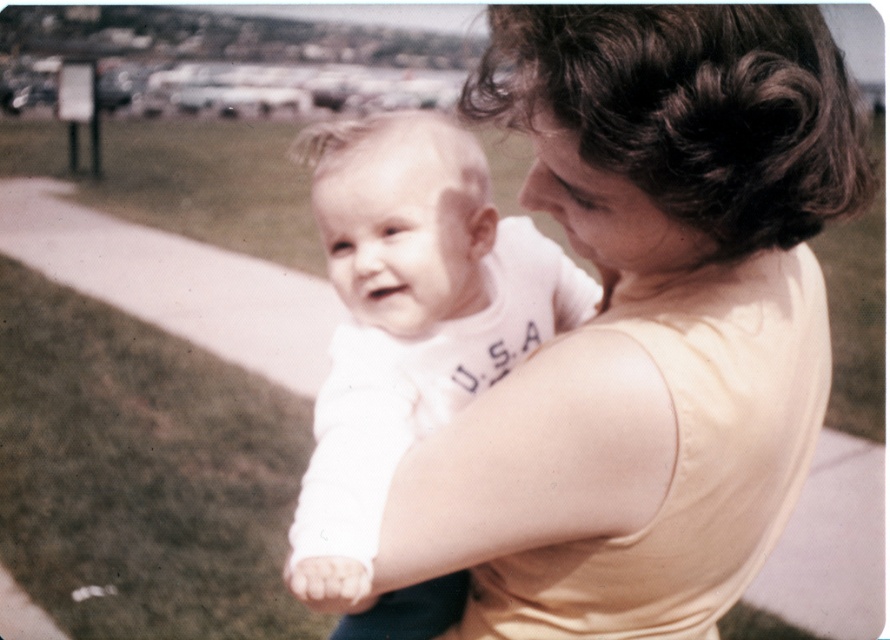
What are the exact coordinates of the matte yellow tank top at center in the image?

The matte yellow tank top at center is located at point (643, 326).

You are a photographer trying to capture the perfect shot of the woman and baby. You notice the matte yellow tank top at center and the white cotton shirt at center. Which clothing item has a greater width in the image?

The matte yellow tank top at center has a greater width than the white cotton shirt at center according to the description.